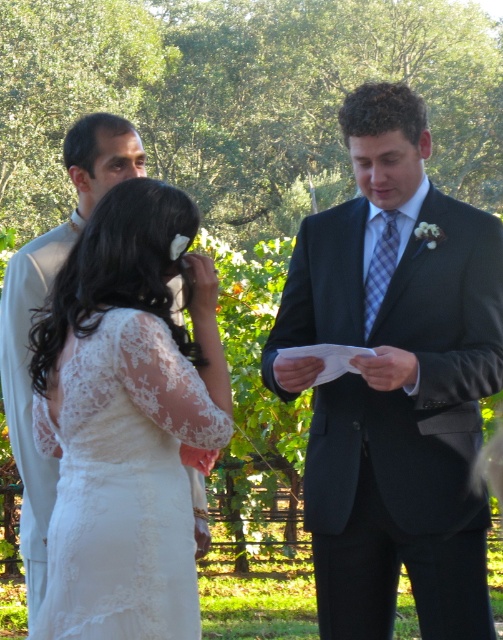
From the picture: You are a photographer at a vineyard wedding and need to position two subjects for a photo. The subjects are wearing the matte black suit at center and the white lace dress at center. Given their clothing dimensions, which subject should you place closer to the camera to ensure both appear proportionally sized in the photo?

The matte black suit at center is wider than the white lace dress at center. To make them appear proportionally sized, place the wider matte black suit at center farther from the camera and the narrower white lace dress at center closer. This way, the wider suit will shrink in size due to distance, balancing their apparent sizes.

Where is the matte black suit at center located in the image?

The matte black suit at center is located at point coordinates of 0.597 on the x axis and 0.785 on the y axis.